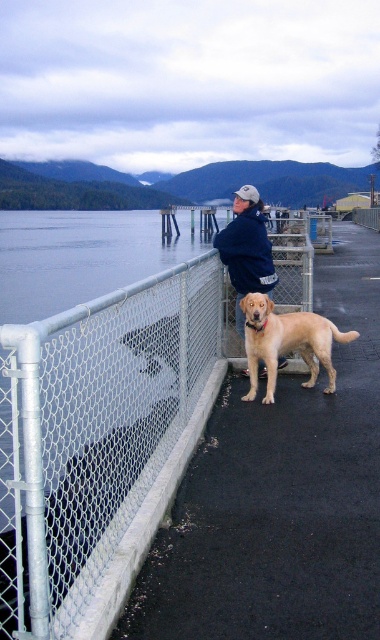
Question: Observing the image, what is the correct spatial positioning of golden fur dog at center in reference to dark blue jacket at center?

Choices:
 (A) below
 (B) above

Answer: (A)

Question: Can you confirm if golden fur dog at center is bigger than dark blue jacket at center?

Choices:
 (A) no
 (B) yes

Answer: (A)

Question: Does white chain-link fence at center-left appear on the right side of dark blue jacket at center?

Choices:
 (A) no
 (B) yes

Answer: (A)

Question: Which of the following is the closest to the observer?

Choices:
 (A) golden fur dog at center
 (B) dark blue jacket at center

Answer: (A)

Question: Among these points, which one is farthest from the camera?

Choices:
 (A) (267, 397)
 (B) (71, 566)
 (C) (264, 372)

Answer: (C)

Question: Which is farther from the golden fur dog at center?

Choices:
 (A) dark blue jacket at center
 (B) white chain-link fence at center-left

Answer: (B)